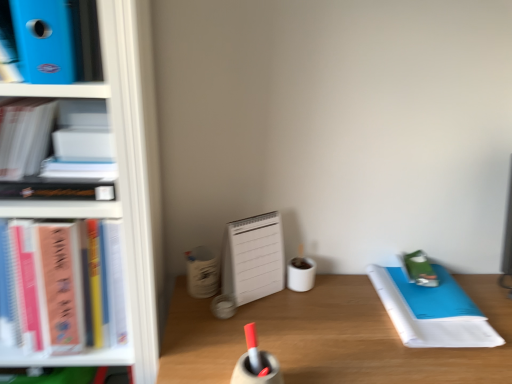
You are a GUI agent. You are given a task and a screenshot of the screen. Output one action in this format:
    pyautogui.click(x=<x>, y=<y>)
    Task: Click on the vacant space that is to the left of white paper notebook at right
    
    Given the screenshot: What is the action you would take?
    pyautogui.click(x=335, y=326)